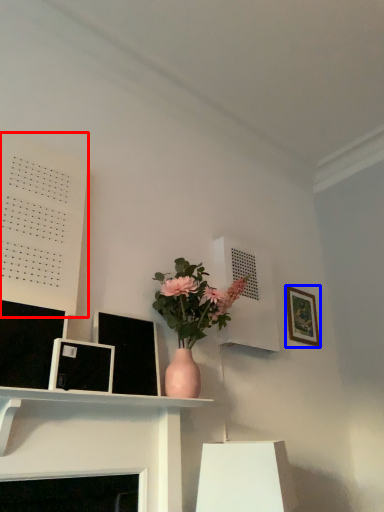
Question: Which object is further to the camera taking this photo, bulletin board (highlighted by a red box) or picture frame (highlighted by a blue box)?

Choices:
 (A) bulletin board
 (B) picture frame

Answer: (B)